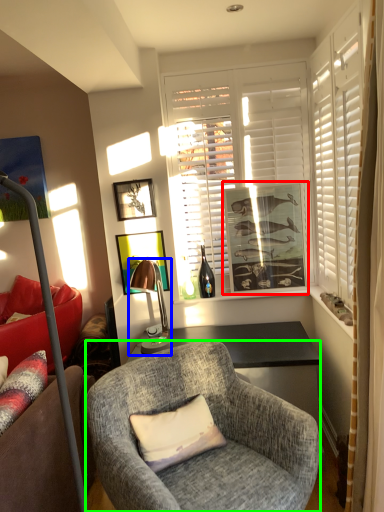
Question: Considering the real-world distances, which object is closest to picture frame (highlighted by a red box)? lamp (highlighted by a blue box) or chair (highlighted by a green box).

Choices:
 (A) lamp
 (B) chair

Answer: (A)